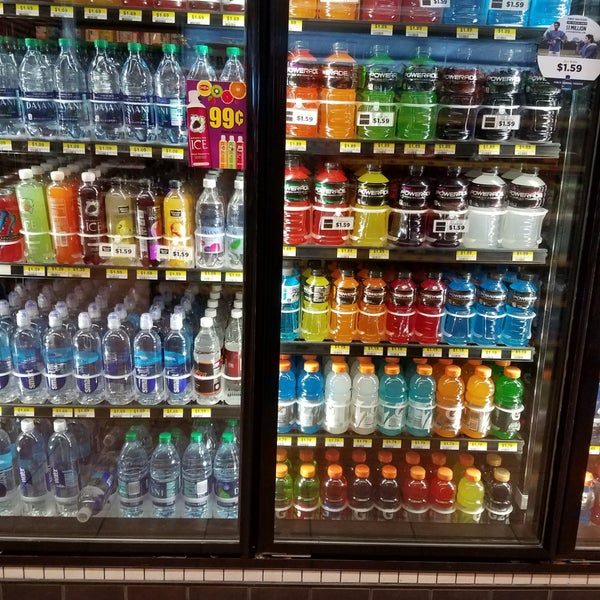
Identify the location of doors to the refrigerated case. This screenshot has width=600, height=600. (270, 247), (250, 242).